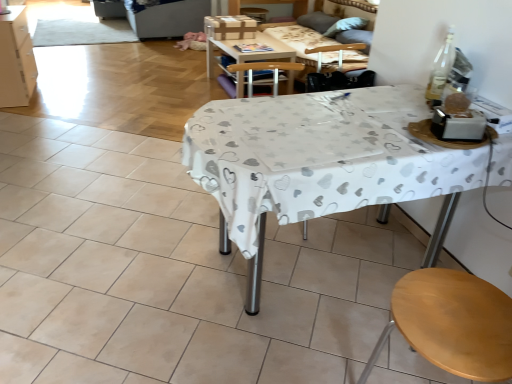
What do you see at coordinates (317, 160) in the screenshot?
I see `white fabric-covered table at center` at bounding box center [317, 160].

The width and height of the screenshot is (512, 384). Describe the element at coordinates (324, 44) in the screenshot. I see `wooden couch at upper center` at that location.

Identify the location of brown cardboard box at upper center. (230, 27).

Locate an element on the screen. white fabric-covered table at center is located at coordinates (317, 160).

What's the angular difference between wooden table at center and brown cardboard box at upper center's facing directions?

There is a 90-degree angle between the facing directions of wooden table at center and brown cardboard box at upper center.

Is point (234, 53) behind point (241, 25)?

No.

The width and height of the screenshot is (512, 384). In order to click on table on the right of brown cardboard box at upper center in this screenshot , I will do `click(249, 53)`.

Measure the distance between white matte cabinet at left and brown cardboard box at upper center.

1.82 meters.

Can you confirm if white matte cabinet at left is thinner than brown cardboard box at upper center?

In fact, white matte cabinet at left might be wider than brown cardboard box at upper center.

Is white matte cabinet at left positioned with its back to brown cardboard box at upper center?

No, white matte cabinet at left is not facing the opposite direction of brown cardboard box at upper center.

Locate an element on the screen. Image resolution: width=512 pixels, height=384 pixels. cabinetry directly beneath the brown cardboard box at upper center (from a real-world perspective) is located at coordinates (16, 60).

You are a GUI agent. You are given a task and a screenshot of the screen. Output one action in this format:
    pyautogui.click(x=<x>, y=<y>)
    Task: Click on the couch to the right of brown cardboard box at upper center
    This screenshot has width=512, height=384.
    Given the screenshot: What is the action you would take?
    pyautogui.click(x=324, y=44)

From the picture: Considering the positions of objects brown cardboard box at upper center and wooden couch at upper center in the image provided, who is more to the right, brown cardboard box at upper center or wooden couch at upper center?

From the viewer's perspective, wooden couch at upper center appears more on the right side.

Can you confirm if brown cardboard box at upper center is thinner than wooden couch at upper center?

Indeed, brown cardboard box at upper center has a lesser width compared to wooden couch at upper center.

How far apart are brown cardboard box at upper center and wooden couch at upper center?

brown cardboard box at upper center and wooden couch at upper center are 66.33 centimeters apart.

Is wooden couch at upper center far from wooden table at center?

No, wooden couch at upper center is in close proximity to wooden table at center.

From the image's perspective, who appears lower, wooden couch at upper center or wooden table at center?

wooden couch at upper center, from the image's perspective.

From a real-world perspective, who is located higher, white matte cabinet at left or wooden couch at upper center?

From a 3D spatial view, wooden couch at upper center is above.

From the image's perspective, is white matte cabinet at left below wooden couch at upper center?

No, from the image's perspective, white matte cabinet at left is not beneath wooden couch at upper center.

Can you confirm if white matte cabinet at left is shorter than wooden couch at upper center?

Incorrect, the height of white matte cabinet at left does not fall short of that of wooden couch at upper center.

Is white matte cabinet at left next to wooden couch at upper center?

They are not placed beside each other.

Is brown cardboard box at upper center facing away from wooden table at center?

No, wooden table at center is not at the back of brown cardboard box at upper center.

From a real-world perspective, is brown cardboard box at upper center above or below wooden table at center?

brown cardboard box at upper center is situated higher than wooden table at center in the real world.

Which object is further away from the camera taking this photo, brown cardboard box at upper center or wooden table at center?

brown cardboard box at upper center is more distant.

Who is shorter, brown cardboard box at upper center or wooden table at center?

Standing shorter between the two is brown cardboard box at upper center.

Does wooden couch at upper center touch white fabric-covered table at center?

wooden couch at upper center is not next to white fabric-covered table at center, and they're not touching.

Is wooden couch at upper center turned away from white fabric-covered table at center?

Yes.

Find the location of a particular element. desk that appears in front of the wooden couch at upper center is located at coordinates (317, 160).

In the scene shown: From the image's perspective, is wooden couch at upper center under white fabric-covered table at center?

No, from the image's perspective, wooden couch at upper center is not below white fabric-covered table at center.

Locate an element on the screen. This screenshot has height=384, width=512. table on the right of the brown cardboard box at upper center is located at coordinates (249, 53).

The height and width of the screenshot is (384, 512). What are the coordinates of `cabinetry located below the brown cardboard box at upper center (from the image's perspective)` in the screenshot? It's located at (16, 60).

Based on their spatial positions, is wooden couch at upper center or white matte cabinet at left further from brown cardboard box at upper center?

white matte cabinet at left is positioned further to the anchor brown cardboard box at upper center.

Considering their positions, is brown cardboard box at upper center positioned closer to white fabric-covered table at center than wooden table at center?

wooden table at center.

Looking at the image, which one is located further to brown cardboard box at upper center, white fabric-covered table at center or wooden couch at upper center?

white fabric-covered table at center is positioned further to the anchor brown cardboard box at upper center.

Which object lies further to the anchor point white fabric-covered table at center, wooden couch at upper center or brown cardboard box at upper center?

Based on the image, brown cardboard box at upper center appears to be further to white fabric-covered table at center.

Looking at this image, from the image, which object appears to be farther from white fabric-covered table at center, brown cardboard box at upper center or white matte cabinet at left?

white matte cabinet at left.

Considering their positions, is wooden table at center positioned closer to wooden couch at upper center than brown cardboard box at upper center?

wooden table at center lies closer to wooden couch at upper center than the other object.

When comparing their distances from white fabric-covered table at center, does wooden table at center or white matte cabinet at left seem further?

Based on the image, white matte cabinet at left appears to be further to white fabric-covered table at center.

Considering their positions, is white fabric-covered table at center positioned closer to white matte cabinet at left than wooden table at center?

The object closer to white matte cabinet at left is wooden table at center.

In order to click on table between white fabric-covered table at center and brown cardboard box at upper center from front to back in this screenshot , I will do `click(249, 53)`.

Where is `box located between white matte cabinet at left and wooden table at center in the left-right direction`? The height and width of the screenshot is (384, 512). box located between white matte cabinet at left and wooden table at center in the left-right direction is located at coordinates (230, 27).

Where is `table between white matte cabinet at left and wooden couch at upper center from left to right`? table between white matte cabinet at left and wooden couch at upper center from left to right is located at coordinates (249, 53).

The width and height of the screenshot is (512, 384). Find the location of `couch between white fabric-covered table at center and brown cardboard box at upper center in the front-back direction`. couch between white fabric-covered table at center and brown cardboard box at upper center in the front-back direction is located at coordinates (324, 44).